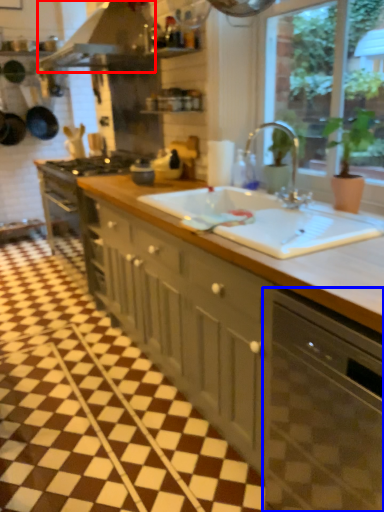
Question: Which object appears closest to the camera in this image, exhaust hood (highlighted by a red box) or dish washer (highlighted by a blue box)?

Choices:
 (A) exhaust hood
 (B) dish washer

Answer: (B)